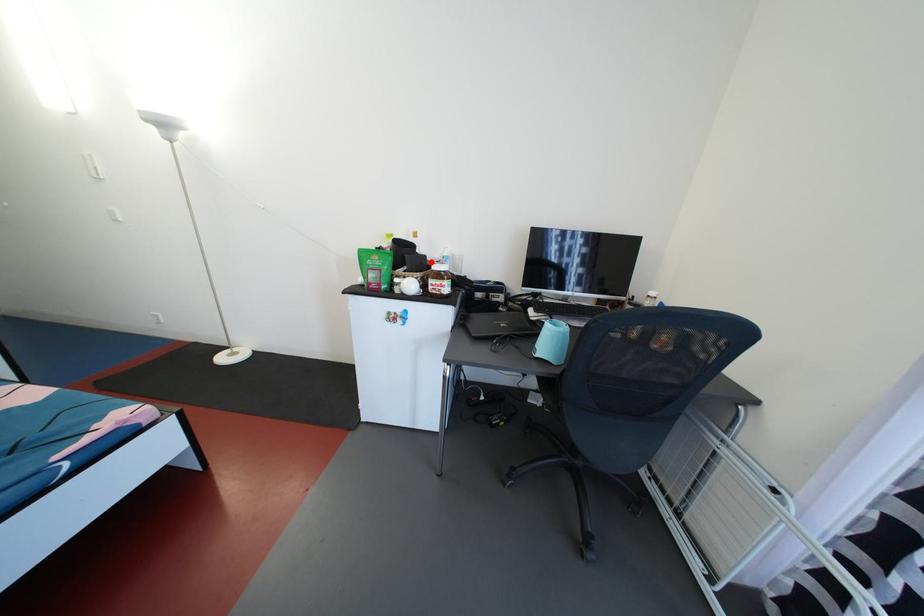
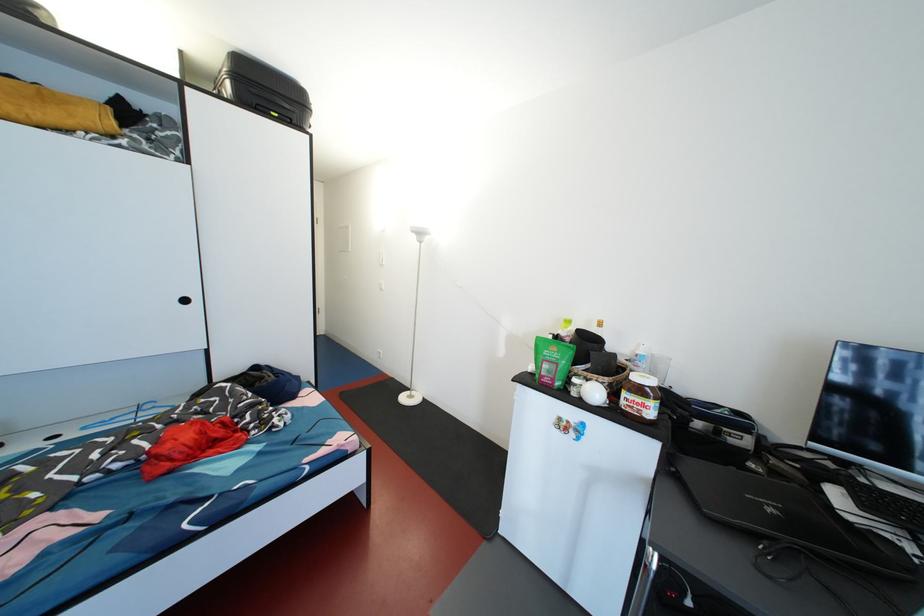
Where in the second image is the point corresponding to the highlighted location from the first image?

(621, 360)